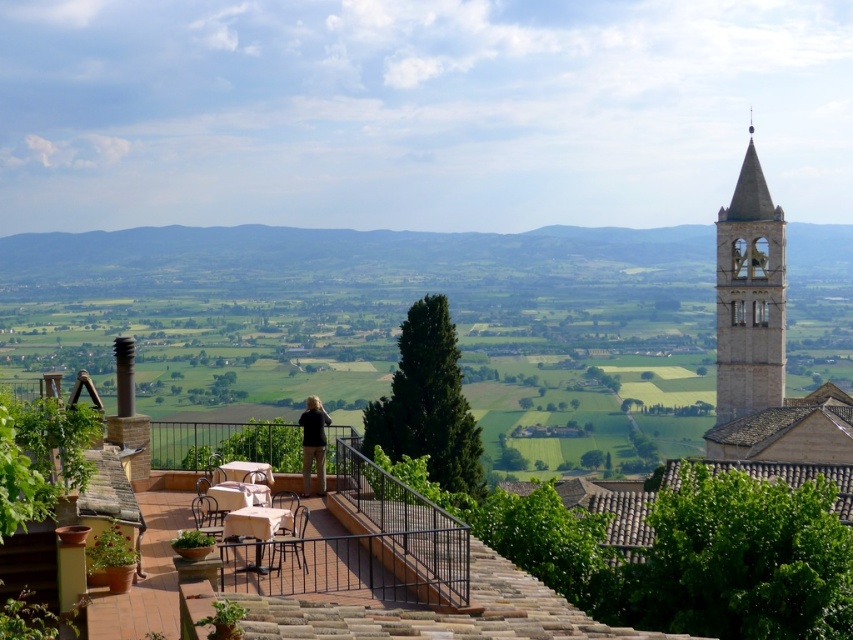
Does beige stone bell tower at right have a lesser width compared to metallic brown chair at lower center?

In fact, beige stone bell tower at right might be wider than metallic brown chair at lower center.

Where is `beige stone bell tower at right`? beige stone bell tower at right is located at coordinates (749, 296).

The height and width of the screenshot is (640, 853). Find the location of `beige stone bell tower at right`. beige stone bell tower at right is located at coordinates (749, 296).

What do you see at coordinates (312, 442) in the screenshot? I see `dark brown leather jacket at center` at bounding box center [312, 442].

Who is more distant from viewer, [310,419] or [299,509]?

Positioned behind is point [310,419].

Find the location of a particular element. This screenshot has height=640, width=853. dark brown leather jacket at center is located at coordinates (312, 442).

Does metallic silver table at lower center have a lesser height compared to wooden chair at lower left?

Correct, metallic silver table at lower center is not as tall as wooden chair at lower left.

Does metallic silver table at lower center appear over wooden chair at lower left?

No.

The width and height of the screenshot is (853, 640). Identify the location of metallic silver table at lower center. (256, 529).

Identify the location of metallic silver table at lower center. This screenshot has width=853, height=640. (256, 529).